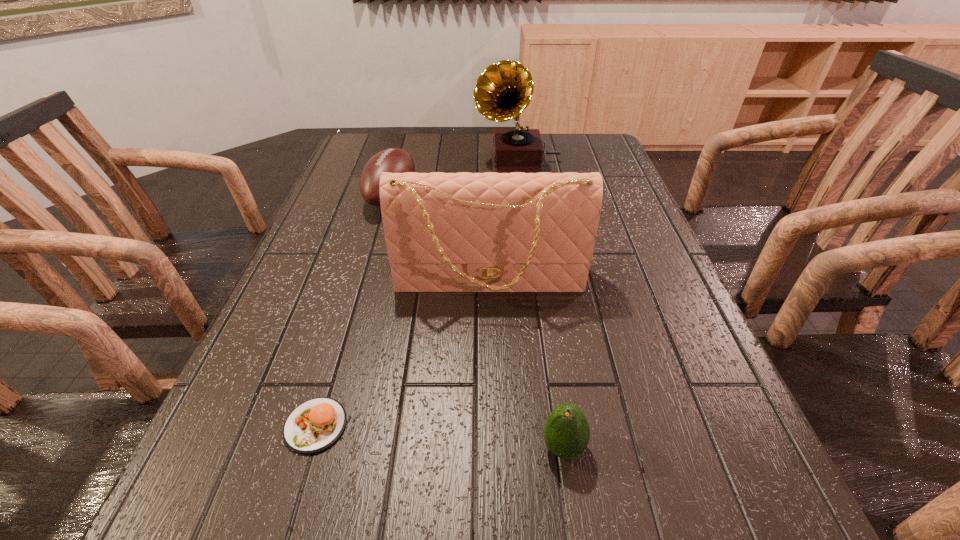
The width and height of the screenshot is (960, 540). Find the location of `free space located 0.280m on the back of the second farthest object`. free space located 0.280m on the back of the second farthest object is located at coordinates (408, 136).

Find the location of a particular element. free location located on the back of the avocado is located at coordinates [547, 338].

Where is `vacant area situated 0.360m on the right of the patty`? vacant area situated 0.360m on the right of the patty is located at coordinates (566, 426).

Where is `object situated at the far edge`? object situated at the far edge is located at coordinates tap(504, 90).

Locate an element on the screen. The height and width of the screenshot is (540, 960). football (American) located at the left edge is located at coordinates (394, 160).

Where is `patty that is at the left edge`? The width and height of the screenshot is (960, 540). patty that is at the left edge is located at coordinates (313, 426).

Where is `free space at the far edge`? This screenshot has width=960, height=540. free space at the far edge is located at coordinates (439, 155).

The width and height of the screenshot is (960, 540). In order to click on vacant space at the left edge of the desktop in this screenshot , I will do `click(251, 479)`.

In the image, there is a desktop. Identify the location of vacant region at the right edge. Image resolution: width=960 pixels, height=540 pixels. (694, 361).

Locate an element on the screen. The image size is (960, 540). vacant space at the far left corner of the desktop is located at coordinates (378, 138).